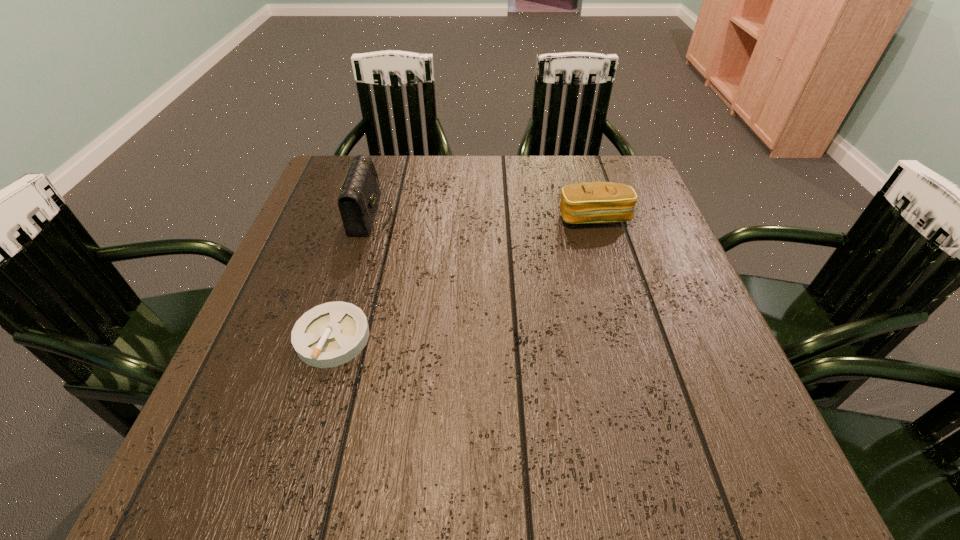
The height and width of the screenshot is (540, 960). I want to click on vacant space at the far right corner of the desktop, so coord(637,178).

Identify the location of free space between the second shortest object and the shortest object. (464, 278).

The width and height of the screenshot is (960, 540). Find the location of `free space between the tallest object and the nearest object`. free space between the tallest object and the nearest object is located at coordinates (351, 276).

I want to click on vacant space in between the right clutch bag and the taller clutch bag, so click(482, 216).

Image resolution: width=960 pixels, height=540 pixels. I want to click on empty space that is in between the left clutch bag and the nearest object, so click(351, 276).

Identify the location of empty space that is in between the taller clutch bag and the right clutch bag. This screenshot has height=540, width=960. (482, 216).

In order to click on unoccupied area between the rightmost object and the taller clutch bag in this screenshot , I will do `click(482, 216)`.

Find the location of a particular element. vacant area between the right clutch bag and the ashtray is located at coordinates (464, 278).

Find the location of a particular element. This screenshot has height=540, width=960. free space between the left clutch bag and the rightmost object is located at coordinates (482, 216).

At what (x,y) coordinates should I click in order to perform the action: click on free point between the second tallest object and the left clutch bag. Please return your answer as a coordinate pair (x, y). The height and width of the screenshot is (540, 960). Looking at the image, I should click on (482, 216).